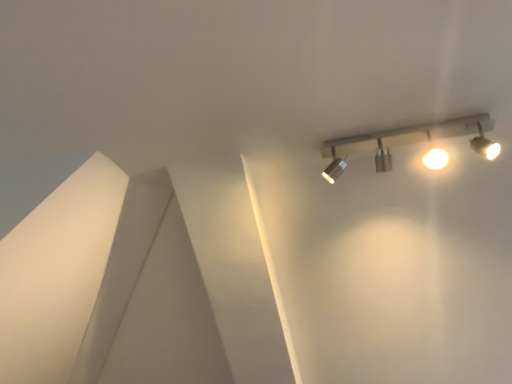
In order to face satin silver spotlight at upper right, should I rotate leftwards or rightwards?

A 19.881 degree turn to the right will do.

Describe the element at coordinates (407, 142) in the screenshot. I see `satin silver spotlight at upper right` at that location.

The width and height of the screenshot is (512, 384). Identify the location of satin silver spotlight at upper right. (407, 142).

The height and width of the screenshot is (384, 512). What are the coordinates of `satin silver spotlight at upper right` in the screenshot? It's located at (407, 142).